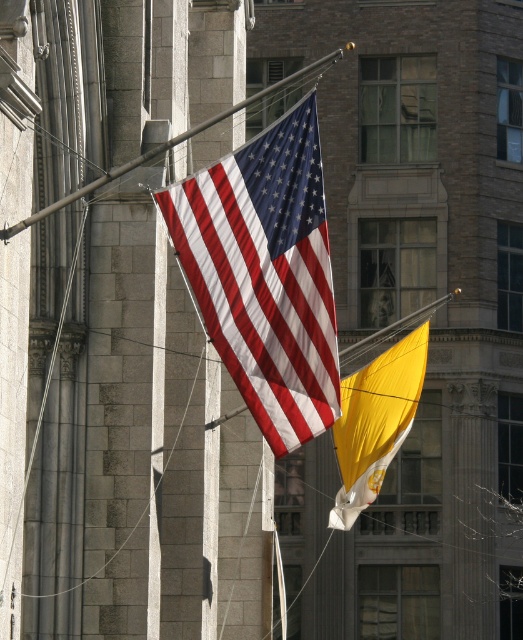
From the picture: You are an event organizer planning to hang two flags for an international festival. The scene shows a matte fabric flag at center and a yellow satin flag at center. Which flag should you choose if you want the taller one for better visibility from afar?

The matte fabric flag at center is much taller than the yellow satin flag at center, so you should choose the matte fabric flag at center for better visibility from afar.

You are standing in front of two flags displayed on a historic building. You notice the matte fabric flag at center and the yellow satin flag at center. Which flag is positioned higher in the arrangement?

The matte fabric flag at center is positioned higher than the yellow satin flag at center.